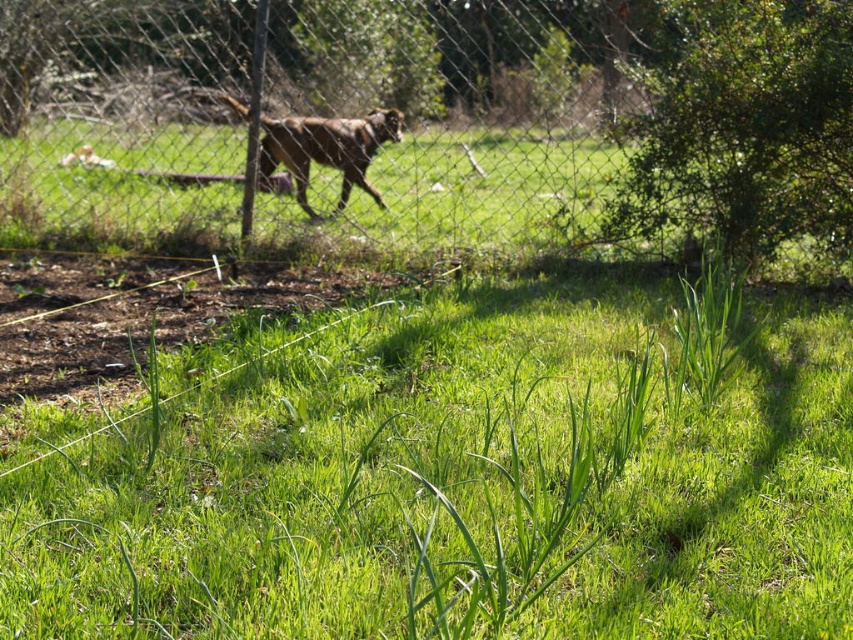
You are standing in the backyard looking at the fence. There are two points marked on the fence at coordinates point (325,548) and point (370,157). Which point is closer to you?

Point (325,548) is closer to the camera than point (370,157).

You are standing in a backyard and see the green grassy at center and the metal mesh fence at upper center. Which object is closer to you?

The green grassy at center is closer to you because it is in front of the metal mesh fence at upper center.